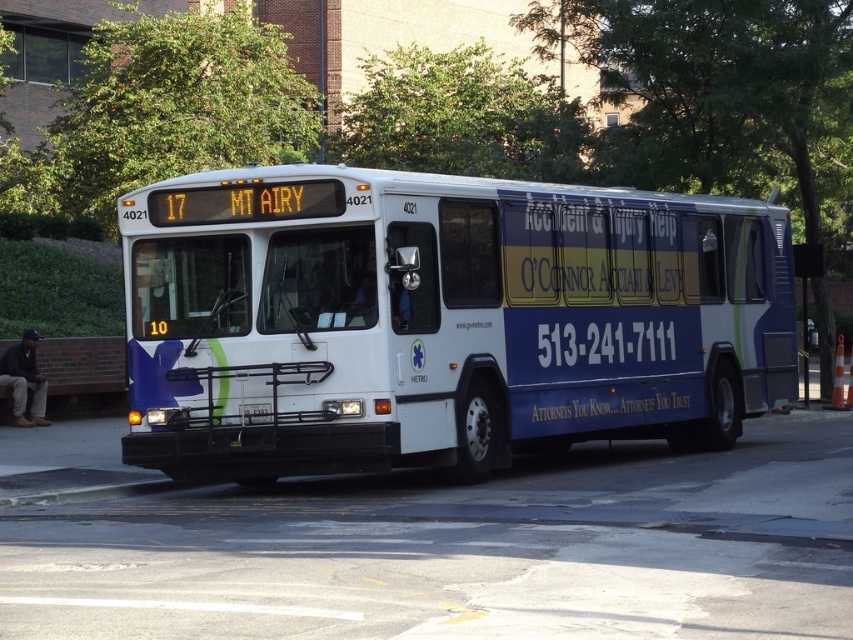
Based on the photo, you are a pedestrian waiting at the bus stop and notice the white glossy bus at center and the black plastic license plate at center. Which object is bigger in size?

The white glossy bus at center is larger in size compared to the black plastic license plate at center.

You are a photographer trying to capture a clear photo of the black plastic license plate at center while standing on the sidewalk. The white glossy bus at center is parked directly in front of you. Considering their sizes, will the license plate be fully visible in your photo?

The white glossy bus at center is wider than the black plastic license plate at center. Since the bus is parked in front of you, its larger width may block parts of the license plate, making it partially or fully obscured depending on the angle and distance. Adjust your position to ensure the license plate is visible.

From the picture: What is the significance of the point at coordinates (440, 320) on the image?

The point at coordinates (440, 320) marks the white glossy bus at center.